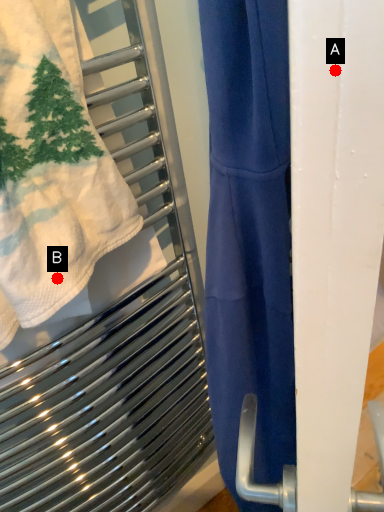
Question: Two points are circled on the image, labeled by A and B beside each circle. Which point appears closest to the camera in this image?

Choices:
 (A) A is closer
 (B) B is closer

Answer: (A)